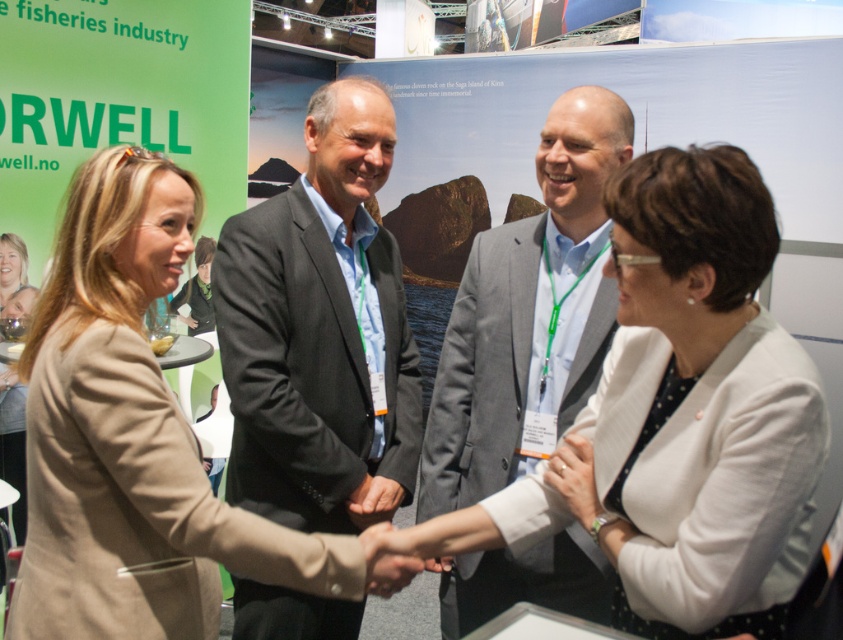
Question: Does gray suit at center appear on the right side of matte black hand at center?

Choices:
 (A) yes
 (B) no

Answer: (A)

Question: Is white textured blazer at center closer to the viewer compared to smooth skin hand at center?

Choices:
 (A) yes
 (B) no

Answer: (A)

Question: Which object is farther from the camera taking this photo?

Choices:
 (A) matte beige blazer at center
 (B) matte black hand at center
 (C) beige fabric coat at center

Answer: (A)

Question: Which of the following is the farthest from the observer?

Choices:
 (A) matte black hand at center
 (B) dark gray suit at center
 (C) white matte ring at center
 (D) white textured blazer at center

Answer: (A)

Question: Is white textured blazer at center positioned in front of beige fabric coat at center?

Choices:
 (A) no
 (B) yes

Answer: (B)

Question: Which object is positioned closest to the white textured blazer at center?

Choices:
 (A) gray suit at center
 (B) matte black hand at center

Answer: (A)